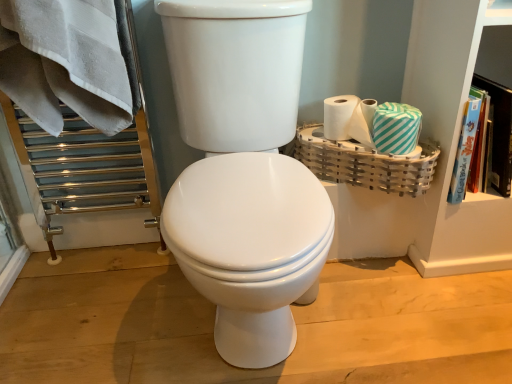
Locate an element on the screen. The image size is (512, 384). blank area to the left of white glossy toilet at center is located at coordinates (105, 304).